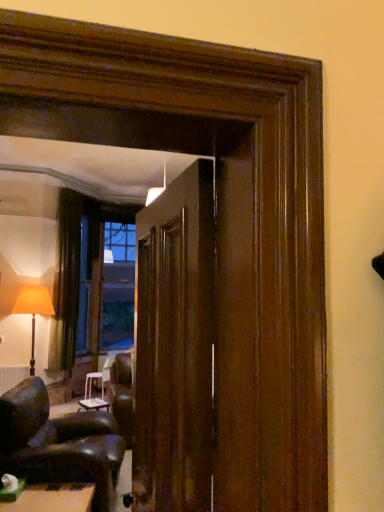
Question: Is white matte radiator at lower left inside the boundaries of white plastic stool at center, marked as the third table in a top-to-bottom arrangement, or outside?

Choices:
 (A) inside
 (B) outside

Answer: (B)

Question: From a real-world perspective, is white matte radiator at lower left physically located above or below white plastic stool at center, the 3th table in the front-to-back sequence?

Choices:
 (A) below
 (B) above

Answer: (B)

Question: Estimate the real-world distances between objects in this image. Which object is closer to the green felt table at lower left, positioned as the first table in front-to-back order?

Choices:
 (A) matte orange fabric lampshade at left
 (B) white glossy table at lower center, positioned as the first table in top-to-bottom order
 (C) leather armchair at lower left
 (D) white plastic stool at center, the 3th table in the front-to-back sequence
 (E) white matte radiator at lower left

Answer: (C)

Question: Which is farther from the white glossy table at lower center, placed as the third table when sorted from bottom to top?

Choices:
 (A) dark brown fabric curtain at left
 (B) glossy wood door at center
 (C) white matte radiator at lower left
 (D) green felt table at lower left, positioned as the first table in front-to-back order
 (E) matte orange fabric lampshade at left

Answer: (B)